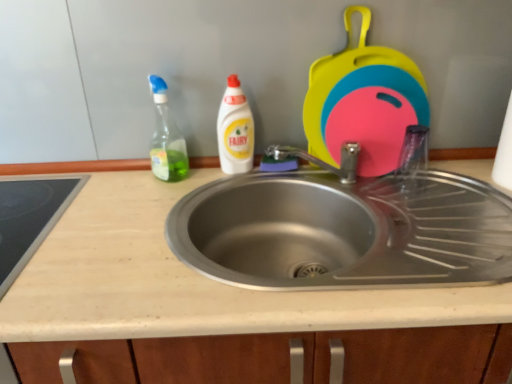
Locate an element on the screen. The image size is (512, 384). beige laminate countertop at center is located at coordinates (187, 281).

Measure the distance between beige laminate countertop at center and camera.

beige laminate countertop at center and camera are 25.63 inches apart.

The image size is (512, 384). Describe the element at coordinates (30, 219) in the screenshot. I see `smooth glass cooktop at left, the 1th appliance positioned from the left` at that location.

The height and width of the screenshot is (384, 512). I want to click on white glossy bottle at center, the 2th cleaning product in the left-to-right sequence, so click(234, 130).

Looking at this image, measure the distance between translucent plastic spray bottle at left, the second cleaning product from the right, and camera.

A distance of 1.02 meters exists between translucent plastic spray bottle at left, the second cleaning product from the right, and camera.

Where is `rubberized plastic cutting boards at upper right, which is counted as the second appliance, starting from the left`? The width and height of the screenshot is (512, 384). rubberized plastic cutting boards at upper right, which is counted as the second appliance, starting from the left is located at coordinates (362, 102).

Is translucent plastic spray bottle at left, the second cleaning product from the right, facing away from rubberized plastic cutting boards at upper right, which is counted as the second appliance, starting from the left?

No, translucent plastic spray bottle at left, the second cleaning product from the right,'s orientation is not away from rubberized plastic cutting boards at upper right, which is counted as the second appliance, starting from the left.

Does point (161, 154) come behind point (367, 125)?

No.

Considering the relative sizes of translucent plastic spray bottle at left, the first cleaning product when ordered from left to right, and rubberized plastic cutting boards at upper right, which appears as the first appliance when viewed from the right, in the image provided, is translucent plastic spray bottle at left, the first cleaning product when ordered from left to right, taller than rubberized plastic cutting boards at upper right, which appears as the first appliance when viewed from the right,?

No, translucent plastic spray bottle at left, the first cleaning product when ordered from left to right, is not taller than rubberized plastic cutting boards at upper right, which appears as the first appliance when viewed from the right.

Considering the sizes of objects rubberized plastic cutting boards at upper right, which appears as the first appliance when viewed from the right, and beige laminate countertop at center in the image provided, who is shorter, rubberized plastic cutting boards at upper right, which appears as the first appliance when viewed from the right, or beige laminate countertop at center?

Standing shorter between the two is rubberized plastic cutting boards at upper right, which appears as the first appliance when viewed from the right.

Is rubberized plastic cutting boards at upper right, which is counted as the second appliance, starting from the left, positioned far away from beige laminate countertop at center?

They are positioned close to each other.

Can you tell me how much rubberized plastic cutting boards at upper right, acting as the first appliance starting from the top, and beige laminate countertop at center differ in facing direction?

The angular difference between rubberized plastic cutting boards at upper right, acting as the first appliance starting from the top, and beige laminate countertop at center is 1.03 degrees.

Image resolution: width=512 pixels, height=384 pixels. In order to click on the 2nd appliance behind the beige laminate countertop at center in this screenshot , I will do `click(362, 102)`.

Between smooth glass cooktop at left, the 2th appliance viewed from the top, and white glossy bottle at center, which appears as the first cleaning product when viewed from the right, which one has smaller size?

With smaller size is white glossy bottle at center, which appears as the first cleaning product when viewed from the right.

Considering the relative sizes of smooth glass cooktop at left, the 2th appliance viewed from the top, and white glossy bottle at center, the 2th cleaning product in the left-to-right sequence, in the image provided, is smooth glass cooktop at left, the 2th appliance viewed from the top, shorter than white glossy bottle at center, the 2th cleaning product in the left-to-right sequence,?

Indeed, smooth glass cooktop at left, the 2th appliance viewed from the top, has a lesser height compared to white glossy bottle at center, the 2th cleaning product in the left-to-right sequence.

Would you consider smooth glass cooktop at left, the 2th appliance viewed from the right, to be distant from white glossy bottle at center, the 2th cleaning product in the left-to-right sequence?

smooth glass cooktop at left, the 2th appliance viewed from the right, is near white glossy bottle at center, the 2th cleaning product in the left-to-right sequence, not far away.

Considering the sizes of objects smooth glass cooktop at left, the 2th appliance viewed from the right, and white glossy bottle at center, which appears as the first cleaning product when viewed from the right, in the image provided, who is wider, smooth glass cooktop at left, the 2th appliance viewed from the right, or white glossy bottle at center, which appears as the first cleaning product when viewed from the right,?

Wider between the two is smooth glass cooktop at left, the 2th appliance viewed from the right.

Is beige laminate countertop at center thinner than translucent plastic spray bottle at left, the first cleaning product when ordered from left to right?

In fact, beige laminate countertop at center might be wider than translucent plastic spray bottle at left, the first cleaning product when ordered from left to right.

Is beige laminate countertop at center turned away from translucent plastic spray bottle at left, the first cleaning product when ordered from left to right?

No, beige laminate countertop at center is not facing away from translucent plastic spray bottle at left, the first cleaning product when ordered from left to right.

From a real-world perspective, is beige laminate countertop at center physically below translucent plastic spray bottle at left, the first cleaning product when ordered from left to right?

Yes, from a real-world perspective, beige laminate countertop at center is below translucent plastic spray bottle at left, the first cleaning product when ordered from left to right.

From a real-world perspective, between smooth glass cooktop at left, the 1th appliance positioned from the left, and rubberized plastic cutting boards at upper right, which is counted as the second appliance, starting from the left, who is vertically higher?

From a 3D spatial view, rubberized plastic cutting boards at upper right, which is counted as the second appliance, starting from the left, is above.

Who is bigger, smooth glass cooktop at left, the 2th appliance viewed from the top, or rubberized plastic cutting boards at upper right, which is counted as the second appliance, starting from the left?

Bigger between the two is rubberized plastic cutting boards at upper right, which is counted as the second appliance, starting from the left.

Is smooth glass cooktop at left, the first appliance positioned from the bottom, placed right next to rubberized plastic cutting boards at upper right, which is counted as the second appliance, starting from the left?

smooth glass cooktop at left, the first appliance positioned from the bottom, and rubberized plastic cutting boards at upper right, which is counted as the second appliance, starting from the left, are clearly separated.

Is smooth glass cooktop at left, the 1th appliance positioned from the left, further to the viewer compared to rubberized plastic cutting boards at upper right, which is counted as the second appliance, starting from the left?

No.

From the image's perspective, does beige laminate countertop at center appear lower than rubberized plastic cutting boards at upper right, acting as the first appliance starting from the top?

Indeed, from the image's perspective, beige laminate countertop at center is shown beneath rubberized plastic cutting boards at upper right, acting as the first appliance starting from the top.

Which object is wider, beige laminate countertop at center or rubberized plastic cutting boards at upper right, positioned as the 2th appliance in bottom-to-top order?

Wider between the two is beige laminate countertop at center.

Is rubberized plastic cutting boards at upper right, which is counted as the second appliance, starting from the left, located within beige laminate countertop at center?

No, beige laminate countertop at center does not contain rubberized plastic cutting boards at upper right, which is counted as the second appliance, starting from the left.

From a real-world perspective, between beige laminate countertop at center and rubberized plastic cutting boards at upper right, acting as the first appliance starting from the top, who is vertically lower?

beige laminate countertop at center.

Measure the distance from translucent plastic spray bottle at left, the first cleaning product when ordered from left to right, to white glossy bottle at center, the 2th cleaning product in the left-to-right sequence.

They are 5.57 inches apart.

Is the surface of translucent plastic spray bottle at left, the first cleaning product when ordered from left to right, in direct contact with white glossy bottle at center, which appears as the first cleaning product when viewed from the right?

No, translucent plastic spray bottle at left, the first cleaning product when ordered from left to right, is not in contact with white glossy bottle at center, which appears as the first cleaning product when viewed from the right.

Between translucent plastic spray bottle at left, the second cleaning product from the right, and white glossy bottle at center, the 2th cleaning product in the left-to-right sequence, which one is positioned behind?

white glossy bottle at center, the 2th cleaning product in the left-to-right sequence, is further away from the camera.

In terms of width, does translucent plastic spray bottle at left, the first cleaning product when ordered from left to right, look wider or thinner when compared to white glossy bottle at center, which appears as the first cleaning product when viewed from the right?

translucent plastic spray bottle at left, the first cleaning product when ordered from left to right, is wider than white glossy bottle at center, which appears as the first cleaning product when viewed from the right.

Image resolution: width=512 pixels, height=384 pixels. Identify the location of appliance on the right of translucent plastic spray bottle at left, the second cleaning product from the right. (362, 102).

This screenshot has width=512, height=384. Find the location of `countertop on the left side of rubberized plastic cutting boards at upper right, positioned as the 2th appliance in bottom-to-top order`. countertop on the left side of rubberized plastic cutting boards at upper right, positioned as the 2th appliance in bottom-to-top order is located at coordinates (187, 281).

Looking at the image, which one is located further to white glossy bottle at center, the 2th cleaning product in the left-to-right sequence, smooth glass cooktop at left, the 1th appliance positioned from the left, or beige laminate countertop at center?

The object further to white glossy bottle at center, the 2th cleaning product in the left-to-right sequence, is smooth glass cooktop at left, the 1th appliance positioned from the left.

Looking at the image, which one is located closer to beige laminate countertop at center, smooth glass cooktop at left, the 1th appliance positioned from the left, or white glossy bottle at center, which appears as the first cleaning product when viewed from the right?

smooth glass cooktop at left, the 1th appliance positioned from the left, is closer to beige laminate countertop at center.

Considering their positions, is white glossy bottle at center, the 2th cleaning product in the left-to-right sequence, positioned closer to beige laminate countertop at center than rubberized plastic cutting boards at upper right, acting as the first appliance starting from the top?

white glossy bottle at center, the 2th cleaning product in the left-to-right sequence, is positioned closer to the anchor beige laminate countertop at center.

Considering their positions, is smooth glass cooktop at left, the 2th appliance viewed from the right, positioned further to translucent plastic spray bottle at left, the first cleaning product when ordered from left to right, than beige laminate countertop at center?

beige laminate countertop at center.

Which object lies nearer to the anchor point translucent plastic spray bottle at left, the second cleaning product from the right, beige laminate countertop at center or smooth glass cooktop at left, the 2th appliance viewed from the top?

smooth glass cooktop at left, the 2th appliance viewed from the top, is positioned closer to the anchor translucent plastic spray bottle at left, the second cleaning product from the right.

Considering their positions, is smooth glass cooktop at left, the 1th appliance positioned from the left, positioned further to translucent plastic spray bottle at left, the first cleaning product when ordered from left to right, than rubberized plastic cutting boards at upper right, which appears as the first appliance when viewed from the right?

rubberized plastic cutting boards at upper right, which appears as the first appliance when viewed from the right.

Which object lies further to the anchor point smooth glass cooktop at left, the first appliance positioned from the bottom, beige laminate countertop at center or rubberized plastic cutting boards at upper right, which appears as the first appliance when viewed from the right?

rubberized plastic cutting boards at upper right, which appears as the first appliance when viewed from the right.

From the image, which object appears to be nearer to smooth glass cooktop at left, the 2th appliance viewed from the right, beige laminate countertop at center or translucent plastic spray bottle at left, the second cleaning product from the right?

beige laminate countertop at center is positioned closer to the anchor smooth glass cooktop at left, the 2th appliance viewed from the right.

The image size is (512, 384). What are the coordinates of `cleaning product between smooth glass cooktop at left, the 2th appliance viewed from the top, and white glossy bottle at center, which appears as the first cleaning product when viewed from the right, from left to right` in the screenshot? It's located at (166, 138).

At what (x,y) coordinates should I click in order to perform the action: click on cleaning product located between translucent plastic spray bottle at left, the first cleaning product when ordered from left to right, and rubberized plastic cutting boards at upper right, acting as the first appliance starting from the top, in the left-right direction. Please return your answer as a coordinate pair (x, y). Looking at the image, I should click on (234, 130).

Where is `cleaning product between white glossy bottle at center, the 2th cleaning product in the left-to-right sequence, and beige laminate countertop at center in the up-down direction`? This screenshot has width=512, height=384. cleaning product between white glossy bottle at center, the 2th cleaning product in the left-to-right sequence, and beige laminate countertop at center in the up-down direction is located at coordinates (166, 138).

I want to click on appliance between translucent plastic spray bottle at left, the second cleaning product from the right, and beige laminate countertop at center in the up-down direction, so click(x=30, y=219).